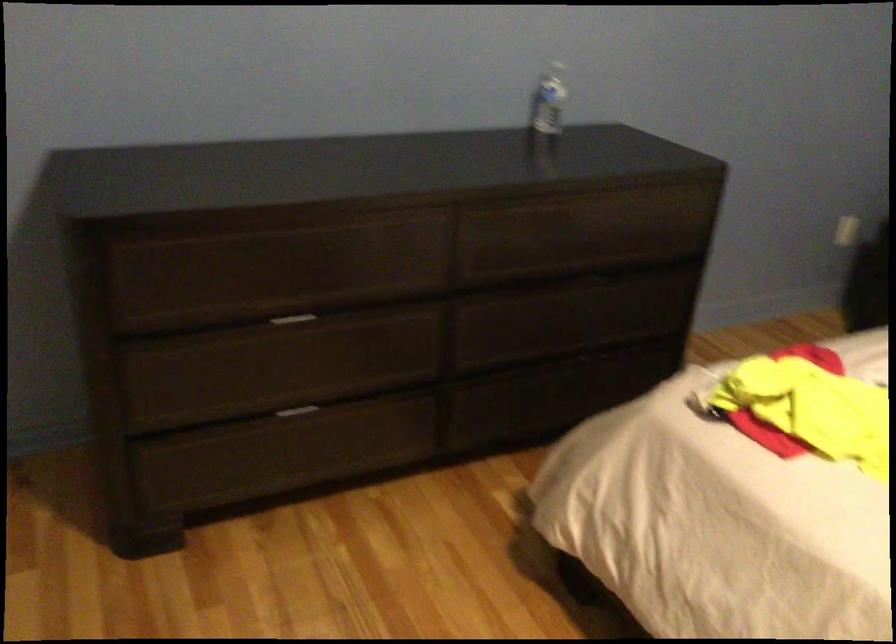
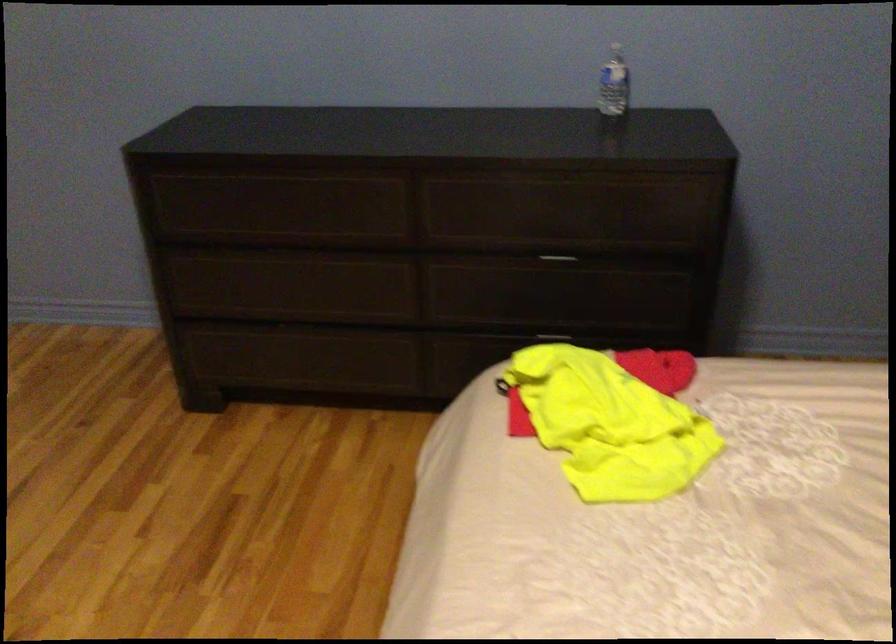
In the second image, find the point that corresponds to point 557,96 in the first image.

(614, 84)